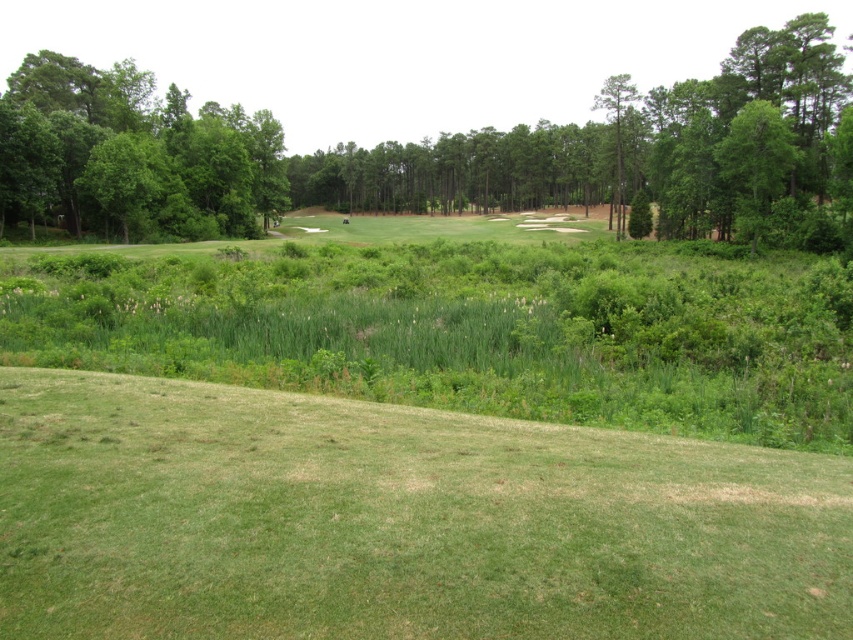
You are standing at the point marked by the coordinates point (643, 150) in the image. What object is located exactly at this point?

The point (643, 150) marks the location of the green leafy tree at center.

You are standing at the origin point of the scene. Which direction should you walk to reach the green grassy hill at lower center?

The green grassy hill at lower center is located at point (395, 522), which is to the lower center direction from your current position at the origin. Walk towards the lower center to reach it.